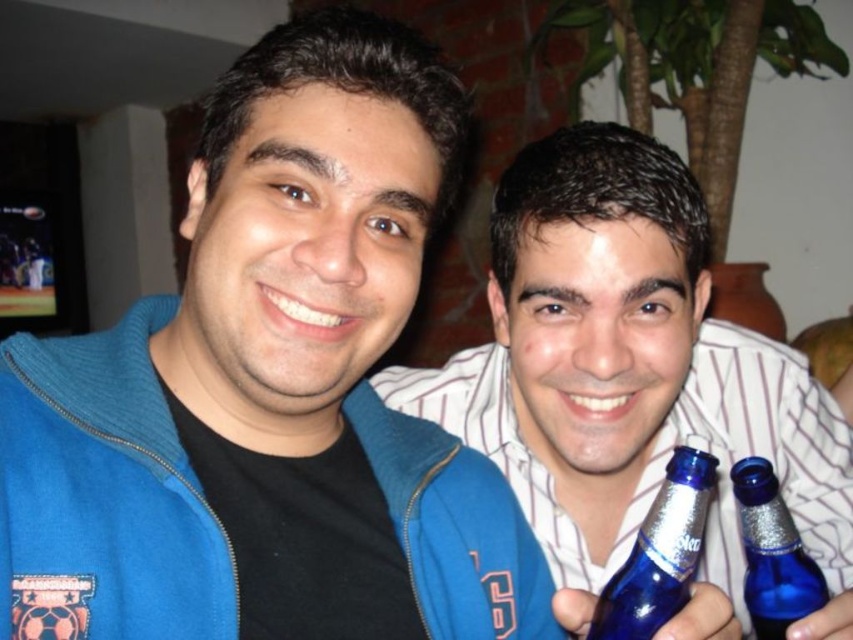
You are trying to locate the blue zip up jacket in the image. There is a point marked at coordinates (270, 388). Based on the description, where is this point located?

The point at (270, 388) is on the blue zip up jacket at center.

You are at a party and want to grab a drink from the center of the image. There are two blue glass bottles mentioned. Which one is closer to you, the blue glass bottle at center or the blue glass bottle at lower right?

The blue glass bottle at center is closer to you because the blue glass bottle at lower right is behind it.